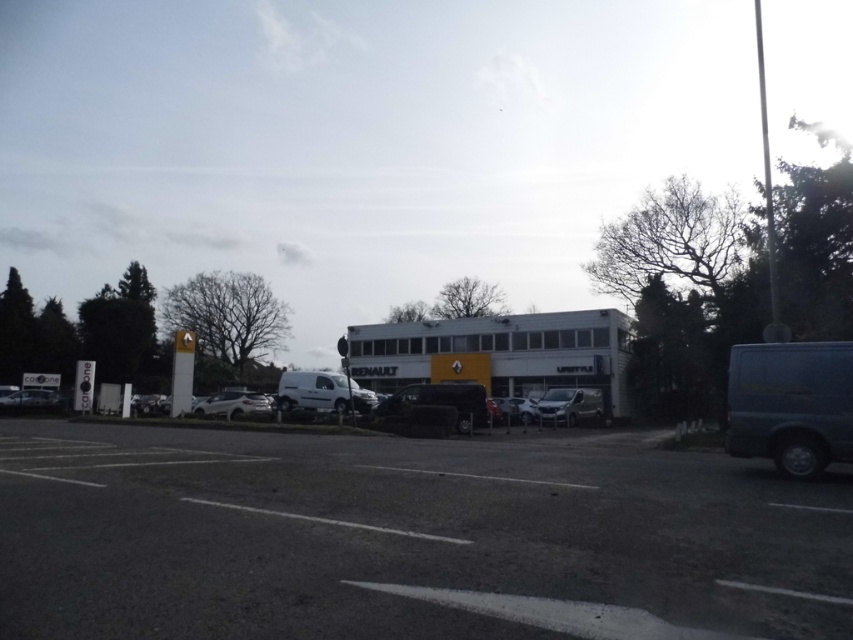
Question: Is dark asphalt parking lot at center thinner than satin silver van at center?

Choices:
 (A) no
 (B) yes

Answer: (A)

Question: Does satin silver van at center have a larger size compared to white glossy car at center?

Choices:
 (A) no
 (B) yes

Answer: (B)

Question: Which point appears closest to the camera in this image?

Choices:
 (A) (350, 406)
 (B) (39, 390)
 (C) (199, 410)
 (D) (599, 397)

Answer: (A)

Question: Which point is closer to the camera?

Choices:
 (A) (299, 394)
 (B) (209, 396)

Answer: (A)

Question: Which point is farther to the camera?

Choices:
 (A) (732, 449)
 (B) (36, 502)
 (C) (581, 401)

Answer: (C)

Question: Observing the image, what is the correct spatial positioning of dark blue metallic van at right in reference to white matte van at center?

Choices:
 (A) above
 (B) below

Answer: (A)